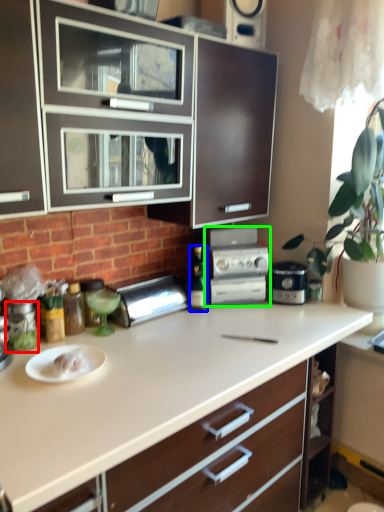
Question: Which is nearer to the appliance (highlighted by a red box)? bottle (highlighted by a blue box) or kitchen appliance (highlighted by a green box).

Choices:
 (A) bottle
 (B) kitchen appliance

Answer: (A)